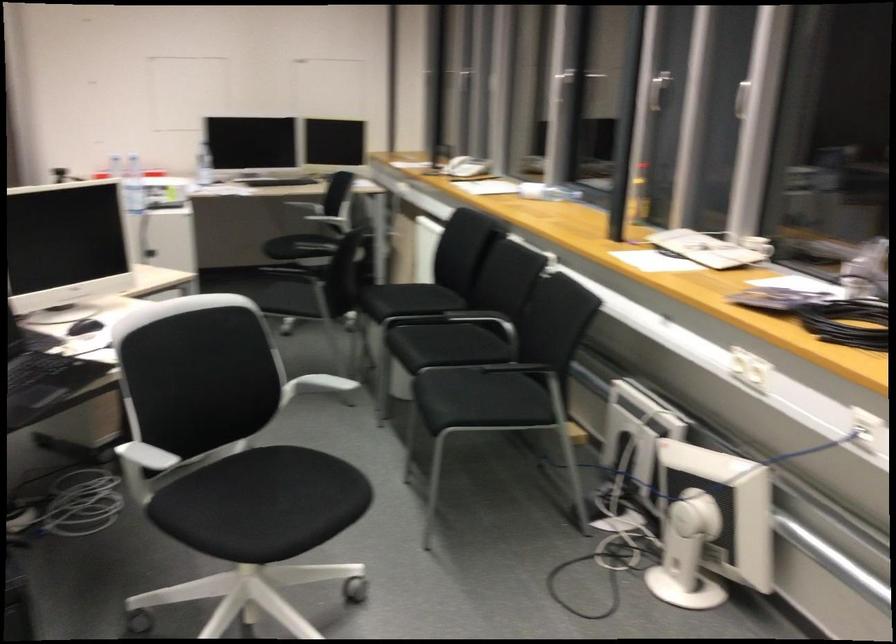
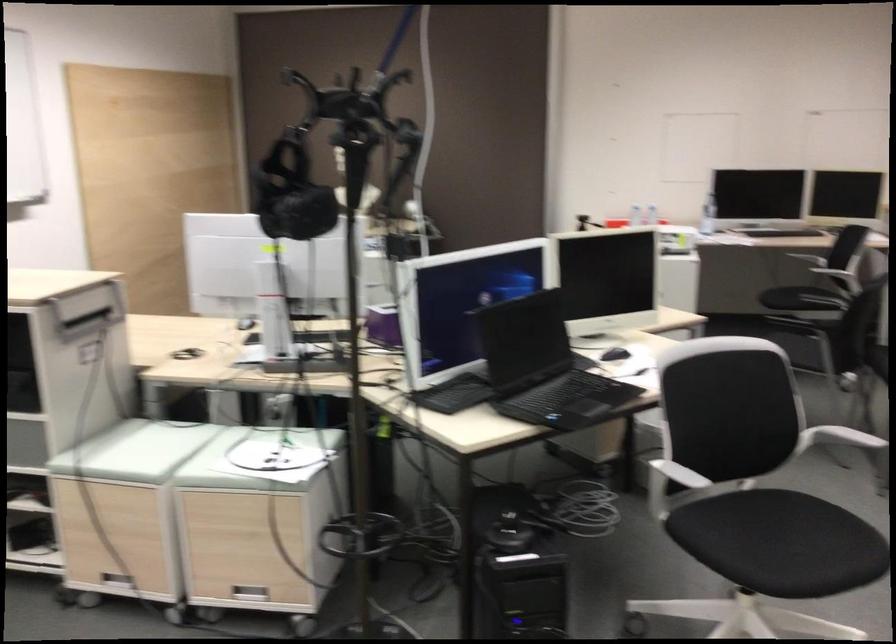
The point at [78,342] is marked in the first image. Where is the corresponding point in the second image?

(615, 354)